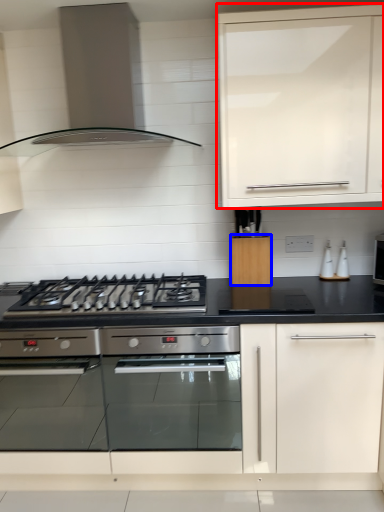
Question: Which object is closer to the camera taking this photo, cabinetry (highlighted by a red box) or cabinetry (highlighted by a blue box)?

Choices:
 (A) cabinetry
 (B) cabinetry

Answer: (A)